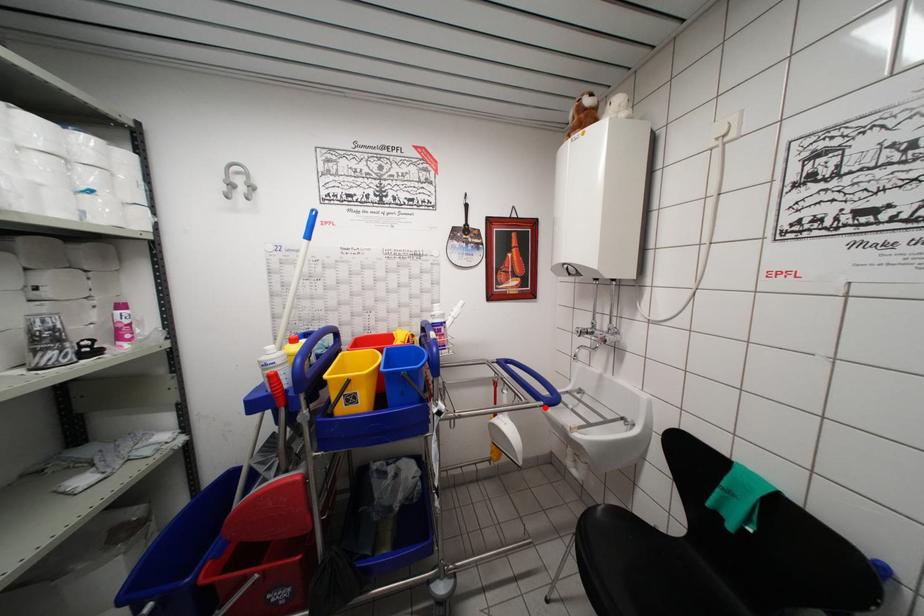
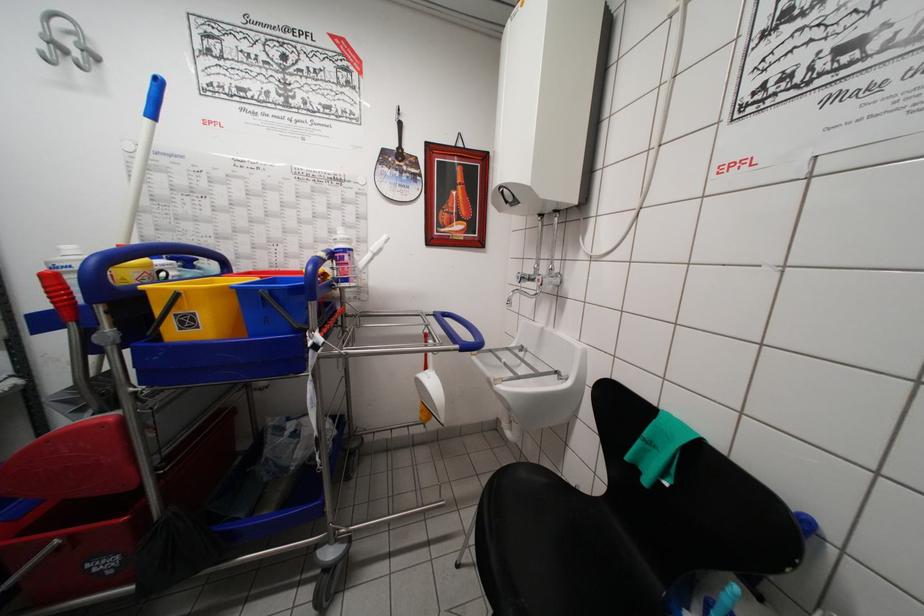
Locate, in the second image, the point that corresponds to the highlighted location in the first image.

(460, 351)